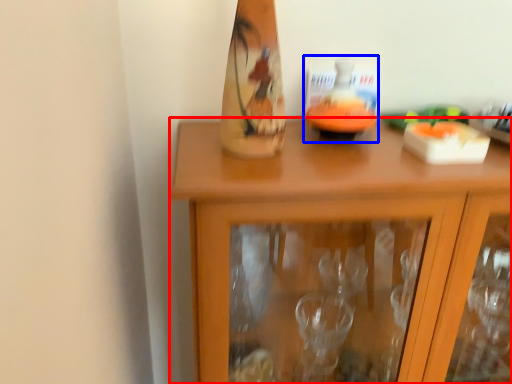
Question: Which object is closer to the camera taking this photo, cabinetry (highlighted by a red box) or candle holder (highlighted by a blue box)?

Choices:
 (A) cabinetry
 (B) candle holder

Answer: (A)